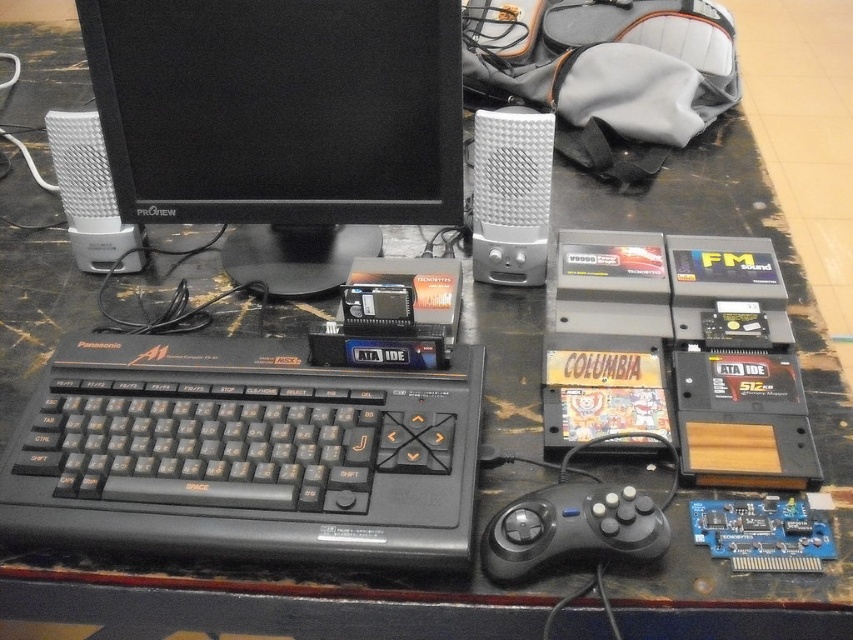
How much distance is there between black plastic computer at center and black plastic keyboard at center?

They are 5.55 centimeters apart.

Consider the image. Can you confirm if black plastic computer at center is thinner than black plastic keyboard at center?

Indeed, black plastic computer at center has a lesser width compared to black plastic keyboard at center.

This screenshot has height=640, width=853. What do you see at coordinates (247, 452) in the screenshot?
I see `black plastic computer at center` at bounding box center [247, 452].

Identify the location of black plastic computer at center. This screenshot has width=853, height=640. (247, 452).

Between black plastic computer at center and white plastic speaker at center, which one is positioned higher?

white plastic speaker at center

Is point (408, 496) more distant than point (71, 141)?

No.

Find the location of a particular element. This screenshot has width=853, height=640. black plastic computer at center is located at coordinates (247, 452).

Find the location of a particular element. black plastic computer at center is located at coordinates (247, 452).

Does point (79, 356) come farther from viewer compared to point (543, 515)?

Yes, it is.

How far apart are black plastic keyboard at center and black matte game controller at lower center?

black plastic keyboard at center and black matte game controller at lower center are 7.49 inches apart from each other.

You are a GUI agent. You are given a task and a screenshot of the screen. Output one action in this format:
    pyautogui.click(x=<x>, y=<y>)
    Task: Click on the black plastic keyboard at center
    The image size is (853, 640).
    Given the screenshot: What is the action you would take?
    pyautogui.click(x=245, y=452)

Locate an element on the screen. This screenshot has width=853, height=640. black plastic keyboard at center is located at coordinates (245, 452).